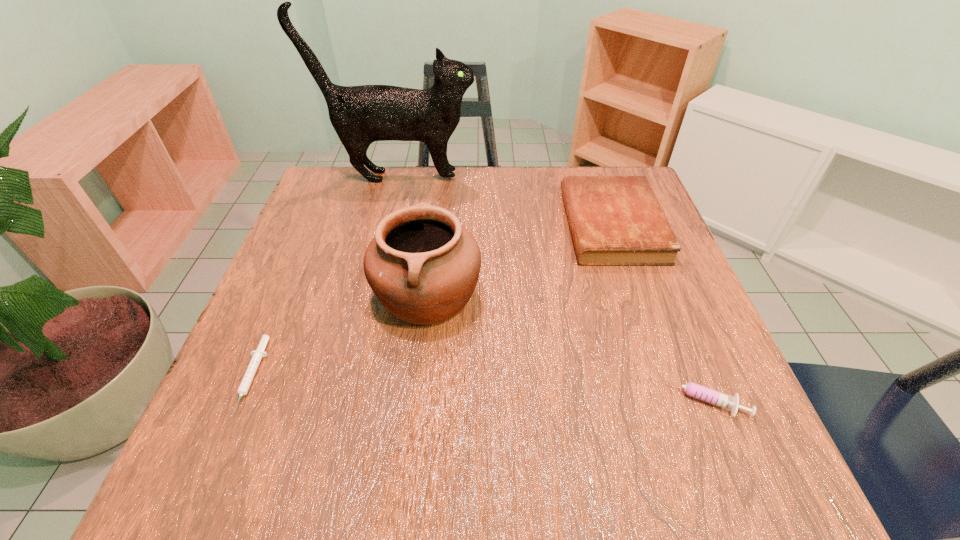
Locate an element on the screen. vacant area that lies between the Bible and the fourth shortest object is located at coordinates (519, 260).

You are a GUI agent. You are given a task and a screenshot of the screen. Output one action in this format:
    pyautogui.click(x=<x>, y=<y>)
    Task: Click on the vacant space that is in between the right syringe and the cat
    
    Given the screenshot: What is the action you would take?
    548,288

Image resolution: width=960 pixels, height=540 pixels. I want to click on vacant region between the taller syringe and the second tallest object, so click(x=563, y=346).

Locate an element on the screen. The width and height of the screenshot is (960, 540). free space between the taller syringe and the shortest object is located at coordinates (475, 388).

Where is `vacant area that lies between the taller syringe and the Bible`? vacant area that lies between the taller syringe and the Bible is located at coordinates (x=655, y=312).

Where is `free space between the shortest object and the tallest object`? free space between the shortest object and the tallest object is located at coordinates (325, 277).

The height and width of the screenshot is (540, 960). I want to click on vacant area that lies between the fourth shortest object and the shorter syringe, so point(340,335).

This screenshot has width=960, height=540. In order to click on vacant point located between the farthest object and the shorter syringe in this screenshot , I will do (325, 277).

Find the location of a particular element. The height and width of the screenshot is (540, 960). empty space that is in between the shorter syringe and the taller syringe is located at coordinates (475, 388).

Identify the location of object that can be found as the second closest to the taller syringe. click(x=423, y=266).